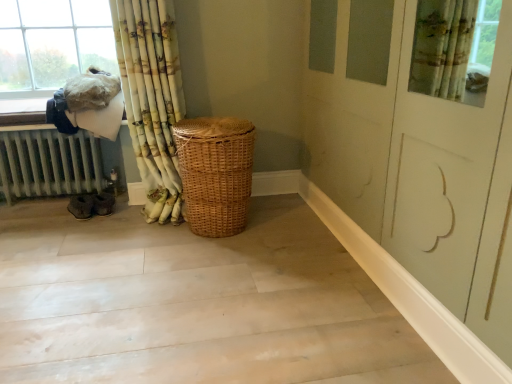
You are a GUI agent. You are given a task and a screenshot of the screen. Output one action in this format:
    pyautogui.click(x=<x>, y=<y>)
    Task: Click on the empty space that is ontop of woven natural basket at center (from a real-world perspective)
    The width and height of the screenshot is (512, 384).
    Given the screenshot: What is the action you would take?
    pyautogui.click(x=220, y=123)